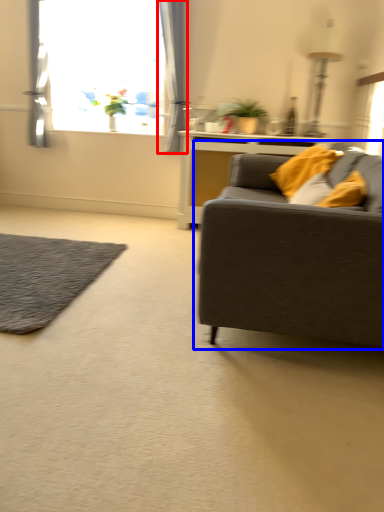
Question: Which of the following is the farthest to the observer, curtain (highlighted by a red box) or studio couch (highlighted by a blue box)?

Choices:
 (A) curtain
 (B) studio couch

Answer: (A)